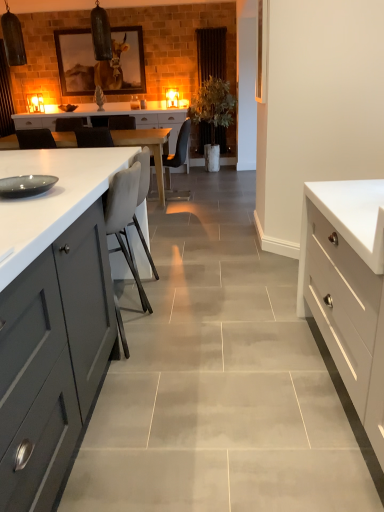
What do you see at coordinates (348, 287) in the screenshot? I see `white glossy drawer at right` at bounding box center [348, 287].

You are a GUI agent. You are given a task and a screenshot of the screen. Output one action in this format:
    pyautogui.click(x=<x>, y=<y>)
    Task: Click on the white matte chair at center, which is counted as the second chair, starting from the top
    This screenshot has height=512, width=384.
    Given the screenshot: What is the action you would take?
    point(124,217)

The width and height of the screenshot is (384, 512). I want to click on green leafy plant at center, so click(213, 105).

Which is correct: white glossy drawer at right is inside wooden framed picture at upper center, or outside of it?

The correct answer is: outside.

Are white glossy drawer at right and wooden framed picture at upper center far apart?

Yes.

From a real-world perspective, which is physically below, white glossy drawer at right or wooden framed picture at upper center?

white glossy drawer at right is physically lower.

Between white glossy drawer at right and wooden framed picture at upper center, which one is positioned in front?

white glossy drawer at right.

From the image's perspective, count 2nd chairs downward from the wooden framed picture at upper center and point to it. Please provide its 2D coordinates.

[(124, 217)]

Is wooden framed picture at upper center oriented towards white matte chair at center, which is counted as the second chair, starting from the top?

Yes, wooden framed picture at upper center is turned towards white matte chair at center, which is counted as the second chair, starting from the top.

Would you say wooden framed picture at upper center is outside white matte chair at center, the first chair ordered from the bottom?

That's correct, wooden framed picture at upper center is outside of white matte chair at center, the first chair ordered from the bottom.

From a real-world perspective, which object stands above the other?

In real-world perspective, white matte chair at center, which is the 2th chair from back to front, is above.

Which of these two, white glossy drawer at right or white matte chair at center, which is counted as the second chair, starting from the top, is bigger?

white glossy drawer at right is bigger.

From the image's perspective, which is below, white glossy drawer at right or white matte chair at center, which is the 2th chair from back to front?

white glossy drawer at right appears lower in the image.

Consider the image. Does white glossy drawer at right turn towards white matte chair at center, which is counted as the second chair, starting from the top?

Yes, white glossy drawer at right is facing white matte chair at center, which is counted as the second chair, starting from the top.

From the image's perspective, who appears lower, white matte chair at center, the first chair ordered from the bottom, or wooden framed picture at upper center?

white matte chair at center, the first chair ordered from the bottom, from the image's perspective.

Is the surface of white matte chair at center, which is the 2th chair from back to front, in direct contact with wooden framed picture at upper center?

white matte chair at center, which is the 2th chair from back to front, is not next to wooden framed picture at upper center, and they're not touching.

Looking at this image, can wooden framed picture at upper center be found inside white matte chair at center, which is the 2th chair from back to front?

Actually, wooden framed picture at upper center is outside white matte chair at center, which is the 2th chair from back to front.

Does white matte chair at center, the first chair ordered from the bottom, lie behind wooden framed picture at upper center?

No, white matte chair at center, the first chair ordered from the bottom, is closer to the viewer.

Considering the relative sizes of wooden framed picture at upper center and white glossy drawer at right in the image provided, is wooden framed picture at upper center smaller than white glossy drawer at right?

Indeed, wooden framed picture at upper center has a smaller size compared to white glossy drawer at right.

The image size is (384, 512). In order to click on picture frame on the left of white glossy drawer at right in this screenshot , I will do `click(101, 62)`.

From the image's perspective, between wooden framed picture at upper center and white glossy drawer at right, which one is located above?

wooden framed picture at upper center.

How much distance is there between wooden framed picture at upper center and white glossy drawer at right?

A distance of 5.26 meters exists between wooden framed picture at upper center and white glossy drawer at right.

Is point (331, 311) closer or farther from the camera than point (202, 109)?

Point (331, 311) appears to be closer to the viewer than point (202, 109).

In the scene shown: From the image's perspective, which one is positioned higher, white glossy drawer at right or green leafy plant at center?

green leafy plant at center appears higher in the image.

Is white glossy drawer at right facing towards green leafy plant at center?

No.

What are the coordinates of `picture frame that is above the matte black chair at center, which is the 2th chair in front-to-back order (from a real-world perspective)` in the screenshot? It's located at (101, 62).

Does wooden framed picture at upper center have a greater height compared to matte black chair at center, marked as the 1th chair in a top-to-bottom arrangement?

Yes.

Is wooden framed picture at upper center to the left of matte black chair at center, the 1th chair from the back, from the viewer's perspective?

Yes, wooden framed picture at upper center is to the left of matte black chair at center, the 1th chair from the back.

At what (x,y) coordinates should I click in order to perform the action: click on picture frame above the white glossy drawer at right (from the image's perspective). Please return your answer as a coordinate pair (x, y). Looking at the image, I should click on (101, 62).

From a real-world perspective, starting from the wooden framed picture at upper center, which chair is the 2nd one below it? Please provide its 2D coordinates.

[(124, 217)]

From the image, which object appears to be nearer to white glossy drawer at right, matte black chair at center, marked as the 1th chair in a top-to-bottom arrangement, or white matte chair at center, which is the 2th chair from back to front?

white matte chair at center, which is the 2th chair from back to front, is closer to white glossy drawer at right.

Based on their spatial positions, is green leafy plant at center or white glossy drawer at right closer to white matte chair at center, marked as the 1th chair in a front-to-back arrangement?

white glossy drawer at right is closer to white matte chair at center, marked as the 1th chair in a front-to-back arrangement.

Considering their positions, is wooden framed picture at upper center positioned further to white glossy drawer at right than matte black chair at center, acting as the 2th chair starting from the bottom?

Based on the image, wooden framed picture at upper center appears to be further to white glossy drawer at right.

From the image, which object appears to be farther from white matte chair at center, which is counted as the second chair, starting from the top, wooden framed picture at upper center or matte black chair at center, the 1th chair from the back?

Among the two, wooden framed picture at upper center is located further to white matte chair at center, which is counted as the second chair, starting from the top.

Which object lies further to the anchor point green leafy plant at center, white glossy drawer at right or white matte chair at center, marked as the 1th chair in a front-to-back arrangement?

white glossy drawer at right is positioned further to the anchor green leafy plant at center.

Looking at the image, which one is located further to green leafy plant at center, wooden framed picture at upper center or white matte chair at center, which is the 2th chair from back to front?

white matte chair at center, which is the 2th chair from back to front.

From the image, which object appears to be nearer to green leafy plant at center, matte black chair at center, acting as the 2th chair starting from the bottom, or wooden framed picture at upper center?

The object closer to green leafy plant at center is matte black chair at center, acting as the 2th chair starting from the bottom.

Which object lies nearer to the anchor point matte black chair at center, marked as the 1th chair in a top-to-bottom arrangement, wooden framed picture at upper center or white glossy drawer at right?

wooden framed picture at upper center.

Locate an element on the screen. This screenshot has height=512, width=384. plant between white matte chair at center, marked as the 1th chair in a front-to-back arrangement, and wooden framed picture at upper center from front to back is located at coordinates (213, 105).

Where is `plant that lies between wooden framed picture at upper center and matte black chair at center, which is the 2th chair in front-to-back order, from top to bottom`? The height and width of the screenshot is (512, 384). plant that lies between wooden framed picture at upper center and matte black chair at center, which is the 2th chair in front-to-back order, from top to bottom is located at coordinates (213, 105).

Identify the location of chair positioned between white glossy drawer at right and matte black chair at center, marked as the 1th chair in a top-to-bottom arrangement, from near to far. (124, 217).

The width and height of the screenshot is (384, 512). Identify the location of chair between white matte chair at center, which is the 2th chair from back to front, and green leafy plant at center in the front-back direction. (178, 160).